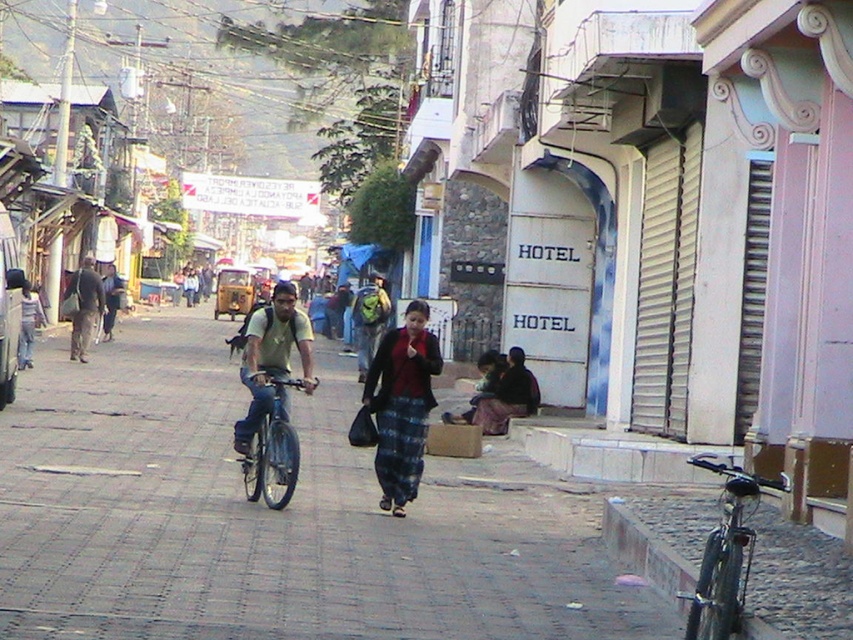
Question: Can you confirm if matte green t-shirt at center is positioned below dark gray backpack at left?

Choices:
 (A) no
 (B) yes

Answer: (B)

Question: Does matte green t-shirt at center have a lesser width compared to dark blue fabric at lower right?

Choices:
 (A) yes
 (B) no

Answer: (B)

Question: Which object appears farthest from the camera in this image?

Choices:
 (A) dark brown fabric at lower right
 (B) matte green t-shirt at center

Answer: (A)

Question: Can you confirm if shiny metallic bicycle at lower right is smaller than matte green t-shirt at center?

Choices:
 (A) no
 (B) yes

Answer: (B)

Question: Which object is the closest to the matte green t-shirt at center?

Choices:
 (A) dark brown fabric at lower right
 (B) shiny metallic bicycle at lower right
 (C) dark blue fabric at lower right

Answer: (C)

Question: Among these points, which one is nearest to the camera?

Choices:
 (A) (379, 344)
 (B) (461, 420)
 (C) (79, 323)

Answer: (B)